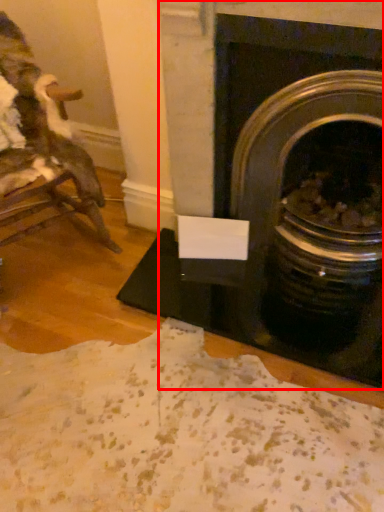
Question: From the image, what is the correct spatial relationship of fireplace (annotated by the red box) in relation to chair?

Choices:
 (A) right
 (B) left

Answer: (A)